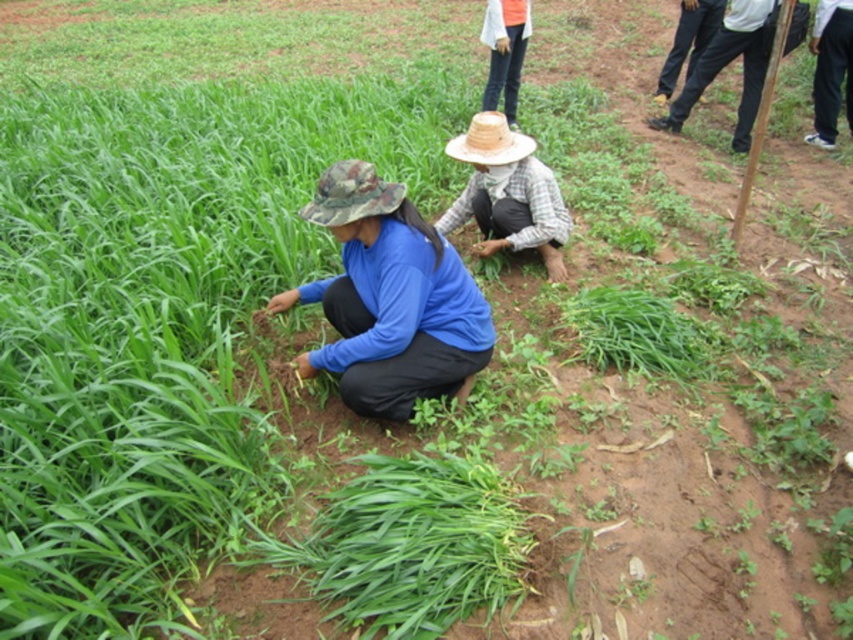
Question: Is dark gray pants at right closer to the viewer compared to woven straw hat at center?

Choices:
 (A) yes
 (B) no

Answer: (B)

Question: Which object appears closest to the camera in this image?

Choices:
 (A) woven straw hat at center
 (B) dark gray pants at right
 (C) blue matte shirt at center
 (D) camo fabric hat at lower left

Answer: (D)

Question: Can you confirm if blue matte shirt at center is positioned to the right of woven straw hat at center?

Choices:
 (A) yes
 (B) no

Answer: (B)

Question: Which point is closer to the camera taking this photo?

Choices:
 (A) (344, 166)
 (B) (445, 371)
 (C) (553, 220)
 (D) (751, 29)

Answer: (A)

Question: Which object is closer to the camera taking this photo?

Choices:
 (A) woven straw hat at center
 (B) plaid fabric hat at center
 (C) dark gray pants at right
 (D) camo fabric hat at lower left

Answer: (D)

Question: From the image, what is the correct spatial relationship of dark gray pants at right in relation to camo fabric hat at lower left?

Choices:
 (A) above
 (B) below

Answer: (A)